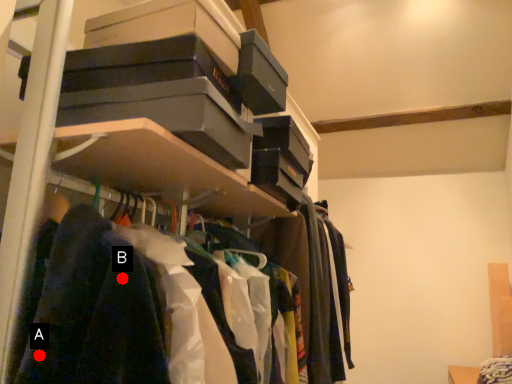
Question: Two points are circled on the image, labeled by A and B beside each circle. Which point is farther to the camera?

Choices:
 (A) A is further
 (B) B is further

Answer: (B)